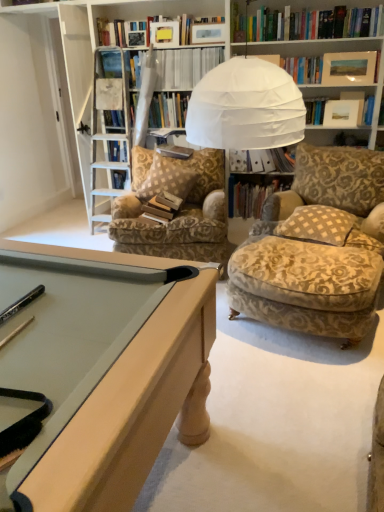
The width and height of the screenshot is (384, 512). Find the location of `hardcover books at center, which ranks as the fourth book in top-to-bottom order`. hardcover books at center, which ranks as the fourth book in top-to-bottom order is located at coordinates (162, 207).

What is the approximate width of velvet beige ottoman at lower right, the 2th chair from the left?

velvet beige ottoman at lower right, the 2th chair from the left, is 22.05 inches in width.

Find the location of a particular element. brown checkered pillow at center, which ranks as the first pillow in left-to-right order is located at coordinates (161, 175).

The height and width of the screenshot is (512, 384). Describe the element at coordinates (100, 368) in the screenshot. I see `light brown wooden pool table at center` at that location.

This screenshot has width=384, height=512. What are the coordinates of `matte wooden picture frame at upper right` in the screenshot? It's located at (349, 68).

Is the position of hardcover books at center, which ranks as the fourth book in top-to-bottom order, more distant than that of white paper book at upper center, the 4th book when ordered from bottom to top?

No, hardcover books at center, which ranks as the fourth book in top-to-bottom order, is closer to the camera.

Is point (173, 209) positioned in front of point (198, 60)?

Yes, point (173, 209) is in front of point (198, 60).

Is hardcover books at center, which appears as the first book when ordered from the bottom, bigger than white paper book at upper center, which is the 1th book in top-to-bottom order?

Incorrect, hardcover books at center, which appears as the first book when ordered from the bottom, is not larger than white paper book at upper center, which is the 1th book in top-to-bottom order.

Considering the sizes of objects white paper file at center, the second book viewed from the top, and hardcover book at center, placed as the second book when sorted from bottom to top, in the image provided, who is smaller, white paper file at center, the second book viewed from the top, or hardcover book at center, placed as the second book when sorted from bottom to top,?

white paper file at center, the second book viewed from the top, is smaller.

From a real-world perspective, is white paper file at center, the second book viewed from the top, over hardcover book at center, positioned as the 3th book in top-to-bottom order?

Correct, in the physical world, white paper file at center, the second book viewed from the top, is higher than hardcover book at center, positioned as the 3th book in top-to-bottom order.

Image resolution: width=384 pixels, height=512 pixels. I want to click on book that is the 1st object located above the hardcover book at center, positioned as the 3th book in top-to-bottom order (from the image's perspective), so click(x=264, y=160).

How far apart are white paper file at center, arranged as the third book when ordered from the bottom, and hardcover book at center, placed as the second book when sorted from bottom to top?

white paper file at center, arranged as the third book when ordered from the bottom, is 7.99 inches away from hardcover book at center, placed as the second book when sorted from bottom to top.

Is beige checkered pillow at center, positioned as the second pillow in back-to-front order, inside the boundaries of hardcover books at center, which ranks as the fourth book in top-to-bottom order, or outside?

beige checkered pillow at center, positioned as the second pillow in back-to-front order, exists outside the volume of hardcover books at center, which ranks as the fourth book in top-to-bottom order.

Can you confirm if beige checkered pillow at center, the 1th pillow viewed from the front, is taller than hardcover books at center, which appears as the first book when ordered from the bottom?

No.

I want to click on the 4th book to the left of the beige checkered pillow at center, positioned as the second pillow in back-to-front order, counting from the anchor's position, so click(162, 207).

Consider the image. Who is bigger, hardcover book at center, positioned as the 3th book in top-to-bottom order, or white paper book at upper center, the 4th book when ordered from bottom to top?

Bigger between the two is white paper book at upper center, the 4th book when ordered from bottom to top.

From the picture: Is hardcover book at center, positioned as the 3th book in top-to-bottom order, oriented towards white paper book at upper center, the 4th book when ordered from bottom to top?

No, hardcover book at center, positioned as the 3th book in top-to-bottom order, is not oriented towards white paper book at upper center, the 4th book when ordered from bottom to top.

Can you confirm if light brown wooden pool table at center is positioned to the right of matte wooden picture frame at upper right?

In fact, light brown wooden pool table at center is to the left of matte wooden picture frame at upper right.

In the scene shown: Relative to matte wooden picture frame at upper right, is light brown wooden pool table at center in front or behind?

In the image, light brown wooden pool table at center appears in front of matte wooden picture frame at upper right.

Is light brown wooden pool table at center taller or shorter than matte wooden picture frame at upper right?

In the image, light brown wooden pool table at center appears to be shorter than matte wooden picture frame at upper right.

Considering the positions of point (8, 484) and point (332, 58), is point (8, 484) closer or farther from the camera than point (332, 58)?

Point (8, 484) is closer to the camera than point (332, 58).

Is matte wooden picture frame at upper right taller than hardcover books at center, which ranks as the fourth book in top-to-bottom order?

No, matte wooden picture frame at upper right is not taller than hardcover books at center, which ranks as the fourth book in top-to-bottom order.

Consider the image. Could you tell me if matte wooden picture frame at upper right is turned towards hardcover books at center, which appears as the first book when ordered from the bottom?

No, matte wooden picture frame at upper right is not facing towards hardcover books at center, which appears as the first book when ordered from the bottom.

Measure the distance between matte wooden picture frame at upper right and hardcover books at center, which ranks as the fourth book in top-to-bottom order.

A distance of 1.68 meters exists between matte wooden picture frame at upper right and hardcover books at center, which ranks as the fourth book in top-to-bottom order.

Would you say matte wooden picture frame at upper right is inside or outside hardcover books at center, which ranks as the fourth book in top-to-bottom order?

matte wooden picture frame at upper right lies outside hardcover books at center, which ranks as the fourth book in top-to-bottom order.

Is hardcover books at center, which appears as the first book when ordered from the bottom, surrounded by light brown wooden pool table at center?

No, hardcover books at center, which appears as the first book when ordered from the bottom, is not inside light brown wooden pool table at center.

Could you tell me if light brown wooden pool table at center is turned towards hardcover books at center, which ranks as the fourth book in top-to-bottom order?

No, light brown wooden pool table at center is not oriented towards hardcover books at center, which ranks as the fourth book in top-to-bottom order.

Is light brown wooden pool table at center at the right side of hardcover books at center, which ranks as the fourth book in top-to-bottom order?

Incorrect, light brown wooden pool table at center is not on the right side of hardcover books at center, which ranks as the fourth book in top-to-bottom order.

From the image's perspective, which book is the 3rd one below the white paper book at upper center, which is the 1th book in top-to-bottom order? Please provide its 2D coordinates.

[(162, 207)]

From a real-world perspective, which book is the 2nd one underneath the white paper file at center, arranged as the third book when ordered from the bottom? Please provide its 2D coordinates.

[(252, 196)]

From the image, which object appears to be farther from matte wooden picture frame at upper right, light brown wooden pool table at center or patterned fabric chair at center, which ranks as the 2th chair in right-to-left order?

light brown wooden pool table at center.

From the image, which object appears to be nearer to hardcover books at center, which appears as the first book when ordered from the bottom, hardcover book at center, placed as the second book when sorted from bottom to top, or patterned fabric chair at center, which ranks as the 2th chair in right-to-left order?

patterned fabric chair at center, which ranks as the 2th chair in right-to-left order.

Looking at the image, which one is located closer to beige checkered pillow at center, positioned as the second pillow in back-to-front order, hardcover books at center, which appears as the first book when ordered from the bottom, or velvet beige ottoman at lower right, which is counted as the first chair, starting from the right?

velvet beige ottoman at lower right, which is counted as the first chair, starting from the right, is positioned closer to the anchor beige checkered pillow at center, positioned as the second pillow in back-to-front order.

Based on their spatial positions, is hardcover books at center, which appears as the first book when ordered from the bottom, or matte wooden picture frame at upper right closer to patterned fabric chair at center, the 1th chair when ordered from left to right?

hardcover books at center, which appears as the first book when ordered from the bottom, is positioned closer to the anchor patterned fabric chair at center, the 1th chair when ordered from left to right.

In the scene shown: From the image, which object appears to be nearer to white paper file at center, the second book viewed from the top, light brown wooden pool table at center or velvet beige ottoman at lower right, which is counted as the first chair, starting from the right?

velvet beige ottoman at lower right, which is counted as the first chair, starting from the right.

Which object lies nearer to the anchor point hardcover books at center, which ranks as the fourth book in top-to-bottom order, white paper book at upper center, which is the 1th book in top-to-bottom order, or hardcover book at center, placed as the second book when sorted from bottom to top?

hardcover book at center, placed as the second book when sorted from bottom to top.

Considering their positions, is velvet beige ottoman at lower right, the 2th chair from the left, positioned further to light brown wooden pool table at center than beige checkered pillow at center, which ranks as the 2th pillow in left-to-right order?

Among the two, beige checkered pillow at center, which ranks as the 2th pillow in left-to-right order, is located further to light brown wooden pool table at center.

Looking at the image, which one is located further to patterned fabric chair at center, which ranks as the 2th chair in right-to-left order, white paper file at center, the second book viewed from the top, or light brown wooden pool table at center?

light brown wooden pool table at center.

Find the location of a particular element. The width and height of the screenshot is (384, 512). pillow located between brown checkered pillow at center, the second pillow positioned from the right, and matte wooden picture frame at upper right in the left-right direction is located at coordinates (317, 225).

Where is `pillow situated between patterned fabric chair at center, the 1th chair when ordered from left to right, and matte wooden picture frame at upper right from left to right`? pillow situated between patterned fabric chair at center, the 1th chair when ordered from left to right, and matte wooden picture frame at upper right from left to right is located at coordinates (317, 225).

Image resolution: width=384 pixels, height=512 pixels. Find the location of `chair between white paper book at upper center, the 4th book when ordered from bottom to top, and beige checkered pillow at center, the 1th pillow when ordered from right to left, in the vertical direction`. chair between white paper book at upper center, the 4th book when ordered from bottom to top, and beige checkered pillow at center, the 1th pillow when ordered from right to left, in the vertical direction is located at coordinates (179, 212).

At what (x,y) coordinates should I click in order to perform the action: click on pillow between light brown wooden pool table at center and hardcover books at center, which ranks as the fourth book in top-to-bottom order, from front to back. Please return your answer as a coordinate pair (x, y). Looking at the image, I should click on (317, 225).